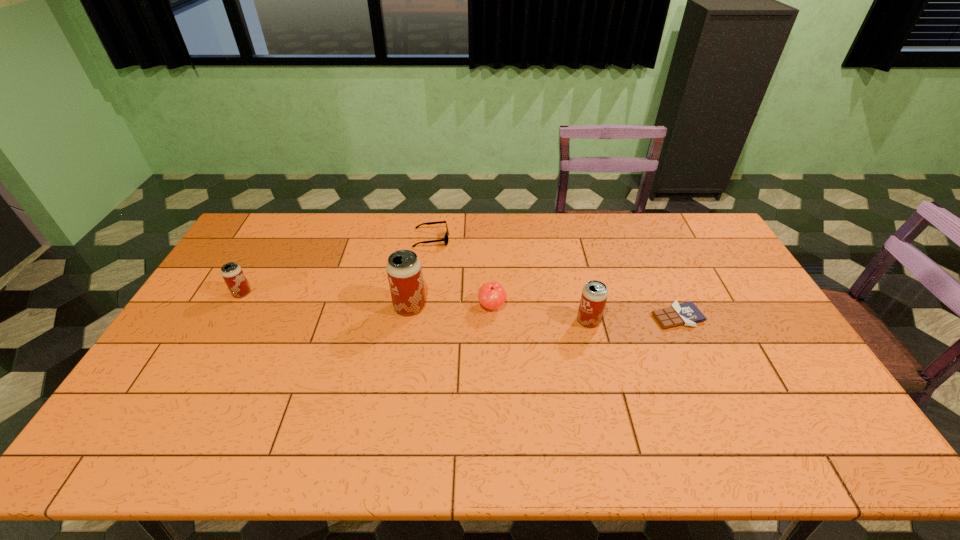
The image size is (960, 540). Find the location of `free space between the fourth object from left to right and the leftmost beer can`. free space between the fourth object from left to right and the leftmost beer can is located at coordinates (367, 300).

At what (x,y) coordinates should I click in order to perform the action: click on free space that is in between the chocolate bar and the leftmost object. Please return your answer as a coordinate pair (x, y). The width and height of the screenshot is (960, 540). Looking at the image, I should click on (460, 305).

This screenshot has width=960, height=540. I want to click on free space between the fifth tallest object and the shortest object, so click(554, 278).

At what (x,y) coordinates should I click in order to perform the action: click on free space between the sunglasses and the fifth shortest object. Please return your answer as a coordinate pair (x, y). The image size is (960, 540). Looking at the image, I should click on (510, 280).

This screenshot has width=960, height=540. What are the coordinates of `object that stands as the second closest to the farthest object` in the screenshot? It's located at (491, 295).

At what (x,y) coordinates should I click in order to perform the action: click on object that is the nearest to the tallest object. Please return your answer as a coordinate pair (x, y). The height and width of the screenshot is (540, 960). Looking at the image, I should click on (491, 295).

Select which beer can appears as the second closest to the second shortest object. Please provide its 2D coordinates. Your answer should be formatted as a tuple, i.e. [(x, y)], where the tuple contains the x and y coordinates of a point satisfying the conditions above.

[(594, 295)]

Select which beer can is the second closest to the leftmost beer can. Please provide its 2D coordinates. Your answer should be formatted as a tuple, i.e. [(x, y)], where the tuple contains the x and y coordinates of a point satisfying the conditions above.

[(594, 295)]

Locate an element on the screen. This screenshot has height=540, width=960. blank area in the image that satisfies the following two spatial constraints: 1. on the front-facing side of the sunglasses; 2. on the left side of the second shortest beer can is located at coordinates (420, 321).

Locate an element on the screen. free space that satisfies the following two spatial constraints: 1. on the front-facing side of the fifth tallest object; 2. on the right side of the second tallest beer can is located at coordinates (420, 321).